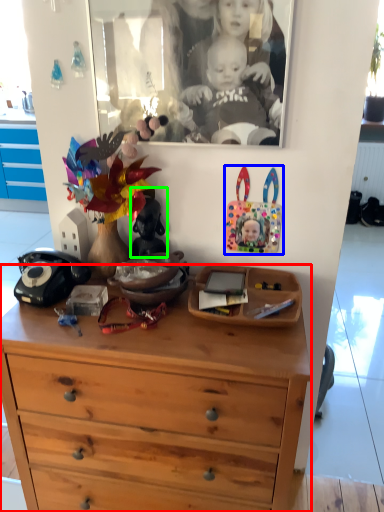
Question: Based on their relative distances, which object is farther from chest of drawers (highlighted by a red box)? Choose from toy (highlighted by a blue box) and toy (highlighted by a green box).

Choices:
 (A) toy
 (B) toy

Answer: (A)